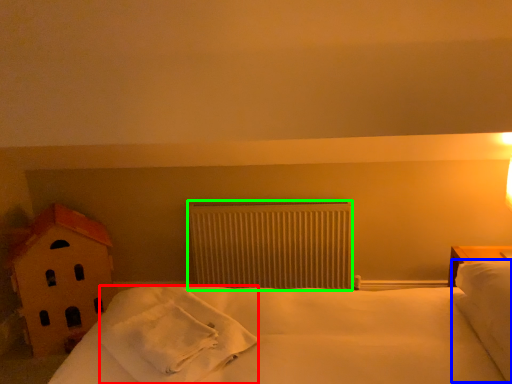
Question: Based on their relative distances, which object is farther from material (highlighted by a red box)? Choose from pillow (highlighted by a blue box) and radiator (highlighted by a green box).

Choices:
 (A) pillow
 (B) radiator

Answer: (A)